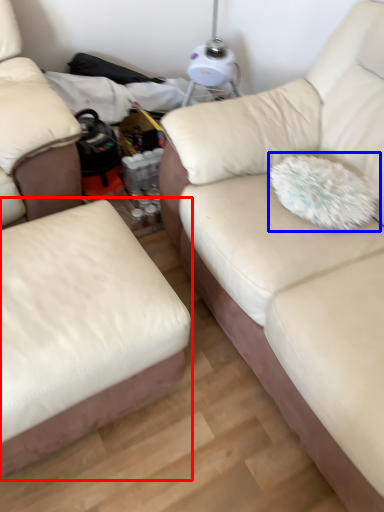
Question: Among these objects, which one is nearest to the camera, studio couch (highlighted by a red box) or throw pillow (highlighted by a blue box)?

Choices:
 (A) studio couch
 (B) throw pillow

Answer: (A)